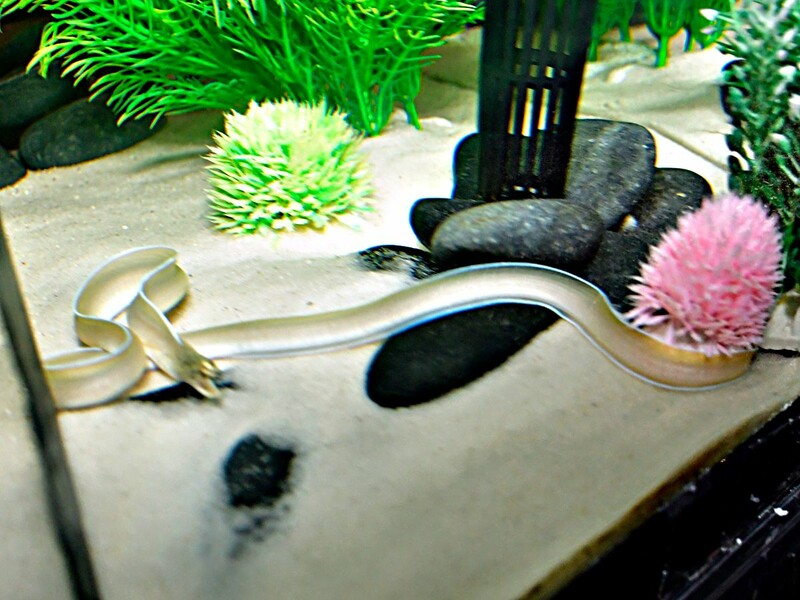
Image resolution: width=800 pixels, height=600 pixels. Find the location of `the bottom of fish tank`. the bottom of fish tank is located at coordinates (729, 569).